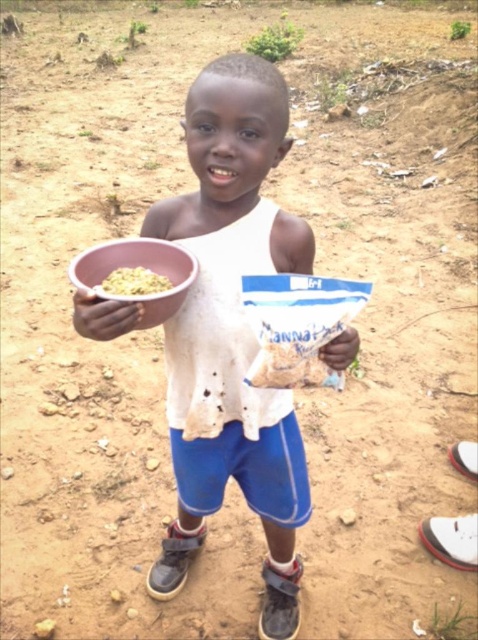
You are a nutritionist observing the child holding two bowls. The pink plastic bowl at lower left and the matte plastic bowl at left. Which bowl is directly above the other?

The pink plastic bowl at lower left is positioned over the matte plastic bowl at left, so it is directly above the matte plastic bowl at left.

You are a photographer trying to capture the child holding both the pink bowl and the MannaPack bag. You notice two points in the image at coordinates point (236, 472) and point (260, 444). Which point is closer to the camera?

Point (236, 472) is closer to the camera than point (260, 444) because it is further to the viewer.